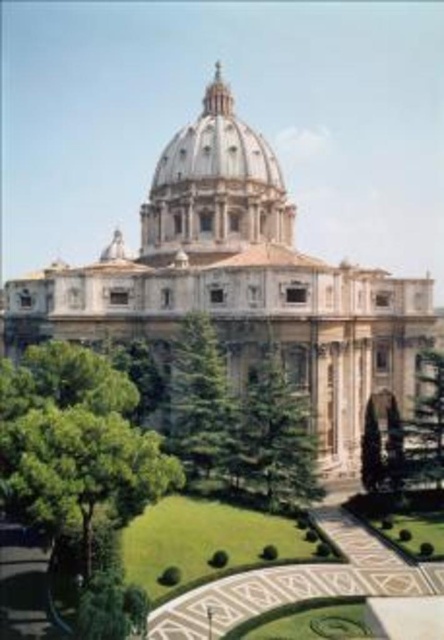
Does green leafy tree at lower left have a larger size compared to green textured tree at center?

Yes, green leafy tree at lower left is bigger than green textured tree at center.

Is point (138, 397) positioned after point (218, 429)?

No, it is not.

You are a GUI agent. You are given a task and a screenshot of the screen. Output one action in this format:
    pyautogui.click(x=<x>, y=<y>)
    Task: Click on the green leafy tree at lower left
    
    Given the screenshot: What is the action you would take?
    pyautogui.click(x=76, y=442)

Does point (218, 371) come behind point (277, 186)?

No.

Does green textured tree at center have a smaller size compared to white marble dome at center?

Yes.

I want to click on green textured tree at center, so click(199, 400).

Identify the location of green textured tree at center. The image size is (444, 640). (199, 400).

Can you confirm if white marble palace at center is smaller than green leafy tree at right?

Incorrect, white marble palace at center is not smaller in size than green leafy tree at right.

Does white marble palace at center have a larger size compared to green leafy tree at right?

Yes.

Image resolution: width=444 pixels, height=640 pixels. Identify the location of white marble palace at center. (240, 282).

Locate an element on the screen. The image size is (444, 640). white marble palace at center is located at coordinates (240, 282).